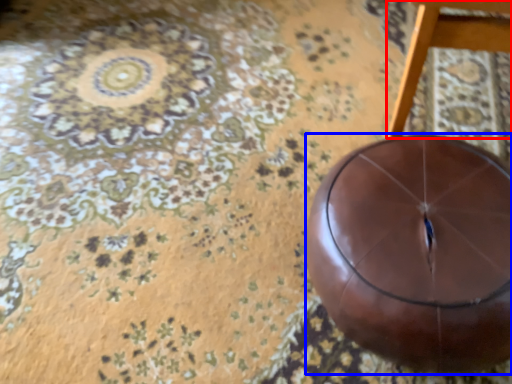
Question: Which point is further to the camera, furniture (highlighted by a red box) or ball (highlighted by a blue box)?

Choices:
 (A) furniture
 (B) ball

Answer: (B)